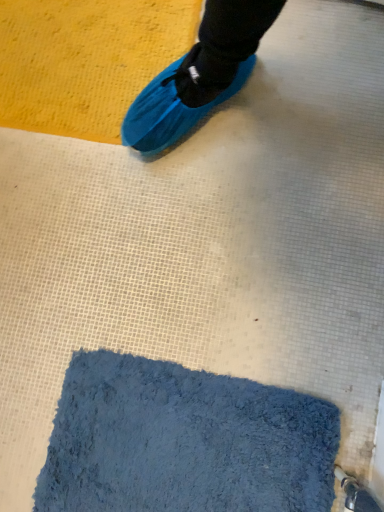
Identify the location of blank area beneath blue fuzzy bath mat at lower center (from a real-world perspective). The image size is (384, 512). (194, 448).